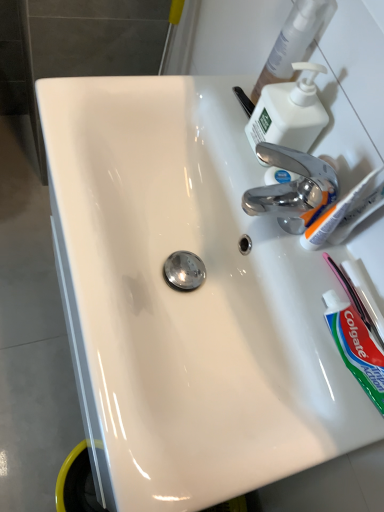
I want to click on free space to the left of pink plastic toothbrush at lower right, which is the first toothbrush from bottom to top, so click(x=294, y=260).